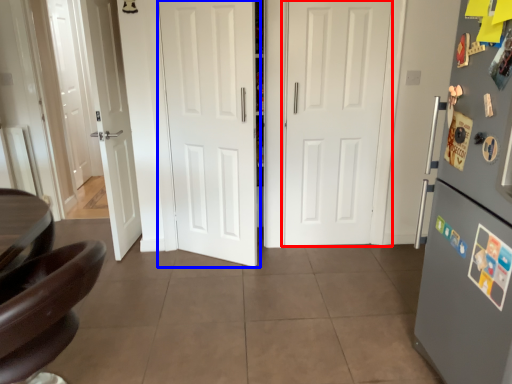
Question: Which of the following is the farthest to the observer, door (highlighted by a red box) or door (highlighted by a blue box)?

Choices:
 (A) door
 (B) door

Answer: (A)